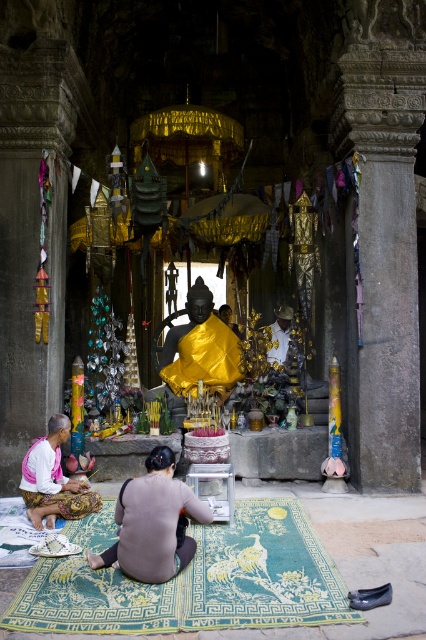
Question: Is gray matte fabric at center thinner than shiny gold statue at center?

Choices:
 (A) no
 (B) yes

Answer: (B)

Question: Estimate the real-world distances between objects in this image. Which object is closer to the green woven mat at lower center?

Choices:
 (A) white cotton robe at lower left
 (B) shiny gold statue at center

Answer: (A)

Question: Is green woven mat at lower center further to camera compared to white cotton robe at lower left?

Choices:
 (A) yes
 (B) no

Answer: (B)

Question: Which of these objects is positioned closest to the shiny gold statue at center?

Choices:
 (A) green woven mat at lower center
 (B) white cotton robe at lower left
 (C) gray matte fabric at center

Answer: (B)

Question: Which of the following is the closest to the observer?

Choices:
 (A) white cotton robe at lower left
 (B) shiny gold statue at center
 (C) green woven mat at lower center
 (D) gray matte fabric at center

Answer: (C)

Question: Does shiny gold statue at center appear under white cotton robe at lower left?

Choices:
 (A) no
 (B) yes

Answer: (A)